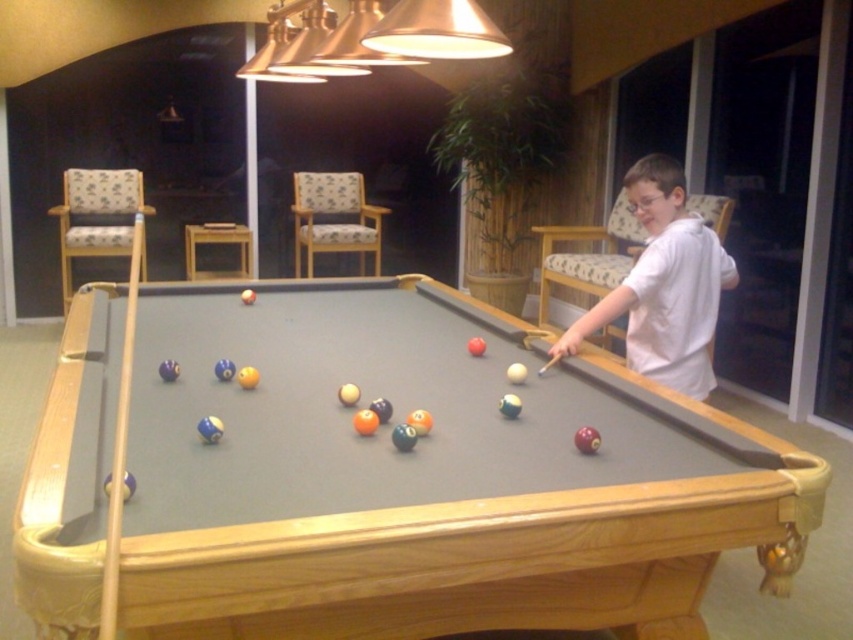
Is wooden billiard table at center above white cotton shirt at right?

No.

How far apart are wooden billiard table at center and white cotton shirt at right?

wooden billiard table at center and white cotton shirt at right are 90.98 centimeters apart.

This screenshot has height=640, width=853. Describe the element at coordinates (426, 477) in the screenshot. I see `wooden billiard table at center` at that location.

This screenshot has width=853, height=640. Identify the location of wooden billiard table at center. (426, 477).

Is white cotton shirt at right shorter than wooden cue at left?

Incorrect, white cotton shirt at right's height does not fall short of wooden cue at left's.

Is point (711, 300) behind point (108, 499)?

Yes, point (711, 300) is farther from viewer.

You are a GUI agent. You are given a task and a screenshot of the screen. Output one action in this format:
    pyautogui.click(x=<x>, y=<y>)
    Task: Click on the white cotton shirt at right
    The width and height of the screenshot is (853, 640).
    Given the screenshot: What is the action you would take?
    pyautogui.click(x=664, y=285)

Between wooden billiard table at center and wooden cue at left, which one has more height?

Standing taller between the two is wooden billiard table at center.

Does point (431, 508) come closer to viewer compared to point (113, 449)?

Yes, it is in front of point (113, 449).

Is point (445, 348) farther from camera compared to point (119, 408)?

Yes, it is.

The width and height of the screenshot is (853, 640). Identify the location of wooden billiard table at center. (426, 477).